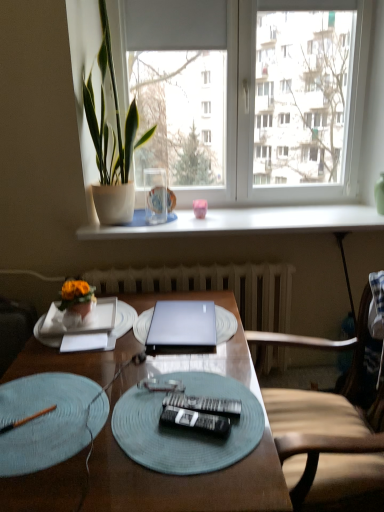
You are a GUI agent. You are given a task and a screenshot of the screen. Output one action in this format:
    pyautogui.click(x=<x>, y=<y>)
    Task: Click on the free space to the right of orange wood pen at lower left
    This screenshot has width=384, height=512.
    Given the screenshot: What is the action you would take?
    pyautogui.click(x=91, y=421)